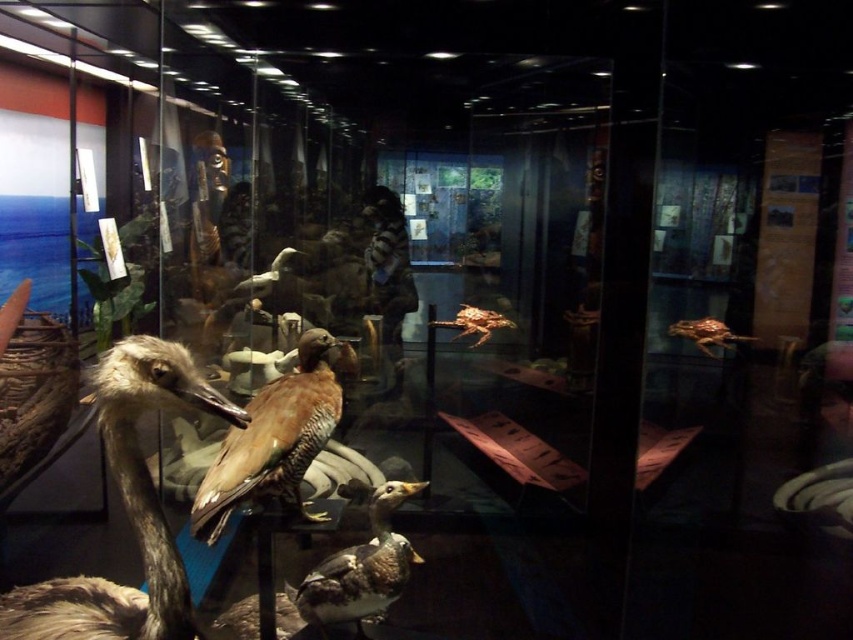
You are a visitor standing in front of the museum exhibit. You want to take a photo of both the brown feathered bird at left and the brown matte duck at center. Which bird should you focus on first to ensure both are in clear focus?

You should focus on the brown feathered bird at left first because it is closer to you than the brown matte duck at center. By focusing on the closer bird, the duck will also be in focus due to the depth of field.

You are standing in front of the museum exhibit and want to touch the point at coordinate point (370,564). The glass case is 2 meters thick. Can you reach the point through the glass case?

The point (370,564) is 1.92 meters from viewer. The glass case is 2 meters thick. Since the distance to the point is less than the glass thickness, you cannot reach it through the glass case.

In the scene shown: You are a visitor standing in front of the museum exhibit. You see the brown feathered bird at right. Can you determine its exact position within the exhibit case?

The brown feathered bird at right is located at point (x=706, y=333) within the exhibit case.